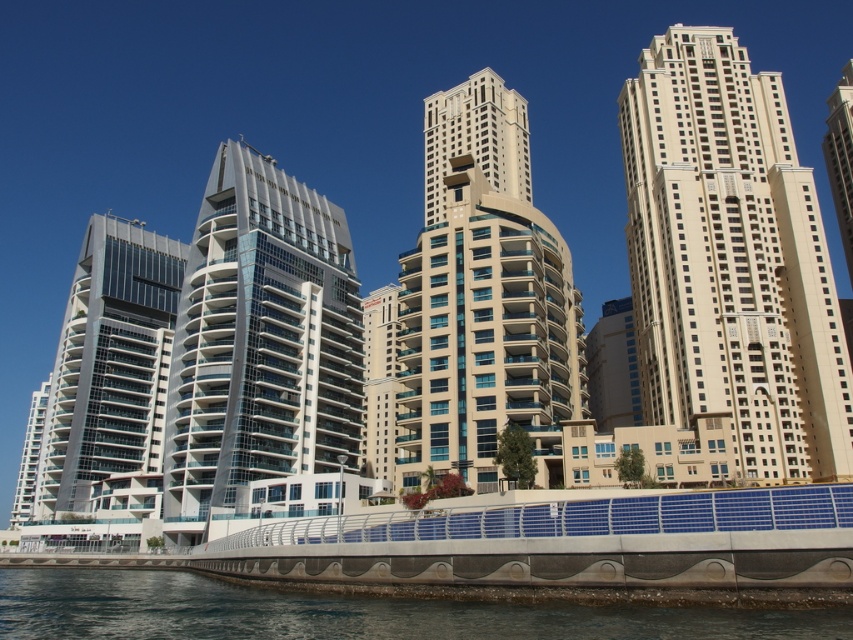
Between beige glass building at center and clear water at lower left, which one has less height?

With less height is clear water at lower left.

Which is below, beige glass building at center or clear water at lower left?

clear water at lower left is below.

Between point (564, 404) and point (515, 627), which one is positioned behind?

Positioned behind is point (564, 404).

Where is `beige glass building at center`? Image resolution: width=853 pixels, height=640 pixels. beige glass building at center is located at coordinates (474, 307).

Can you confirm if white glass building at center is positioned below metallic glass building at left?

No, white glass building at center is not below metallic glass building at left.

Does white glass building at center have a greater height compared to metallic glass building at left?

No, white glass building at center is not taller than metallic glass building at left.

I want to click on white glass building at center, so click(x=260, y=342).

Between metallic glass building at left and beige glass tower at upper right, which one is positioned lower?

metallic glass building at left is lower down.

Which is behind, point (157, 276) or point (843, 67)?

Positioned behind is point (843, 67).

Measure the distance between metallic glass building at left and camera.

metallic glass building at left and camera are 245.83 feet apart from each other.

At what (x,y) coordinates should I click in order to perform the action: click on metallic glass building at left. Please return your answer as a coordinate pair (x, y). This screenshot has width=853, height=640. Looking at the image, I should click on (103, 376).